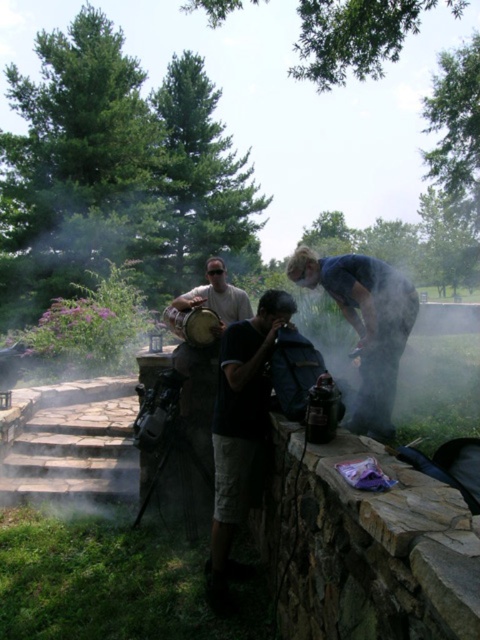
You are observing a group of people near a stone wall with a grill. There are two people wearing shirts labeled as dark blue shirt at center and matte brown shirt at center. Which shirt is positioned lower relative to the other?

The dark blue shirt at center is located below the matte brown shirt at center.

You are standing at the point labeled point [315,273] and want to move to point [168,320]. Is the path between them clear of any obstacles?

Yes, the path between point [315,273] and point [168,320] is clear of any obstacles because the description only mentions their relative positions and does not indicate any objects blocking the path.

You are looking at the scene and see the dark blue shirt at center and the matte brown shirt at center. Which one is positioned to the right?

The dark blue shirt at center is positioned to the right of the matte brown shirt at center.